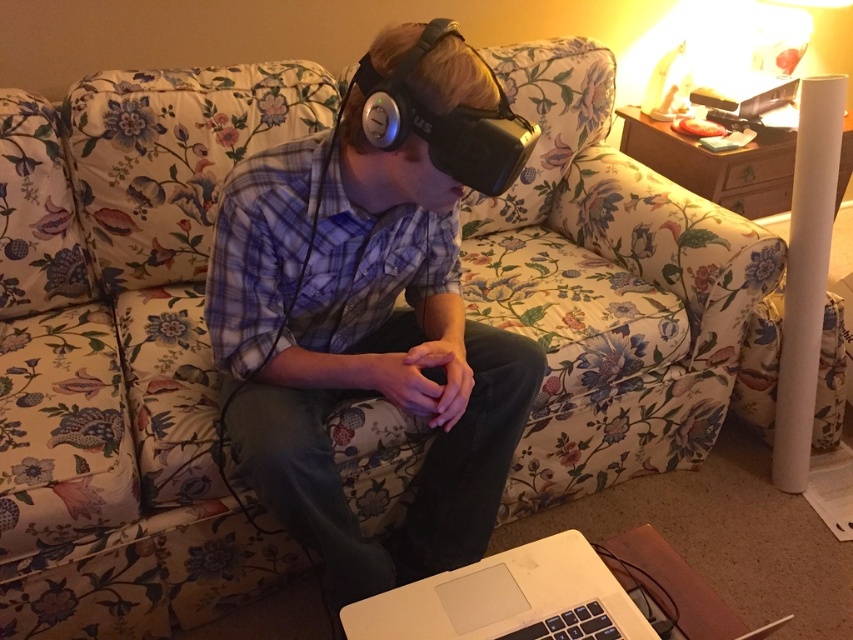
Can you confirm if matte black vr headset at center is thinner than white matte laptop at lower center?

Incorrect, matte black vr headset at center's width is not less than white matte laptop at lower center's.

Which is above, matte black vr headset at center or white matte laptop at lower center?

matte black vr headset at center is above.

Is point (282, 180) in front of point (396, 618)?

No, it is not.

Where is `matte black vr headset at center`? matte black vr headset at center is located at coordinates (370, 312).